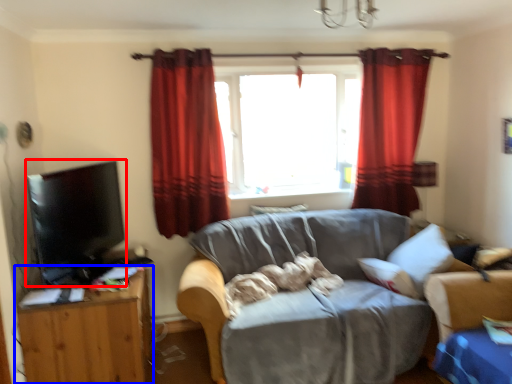
Question: Which of the following is the closest to the observer, flat (highlighted by a red box) or table (highlighted by a blue box)?

Choices:
 (A) flat
 (B) table

Answer: (A)